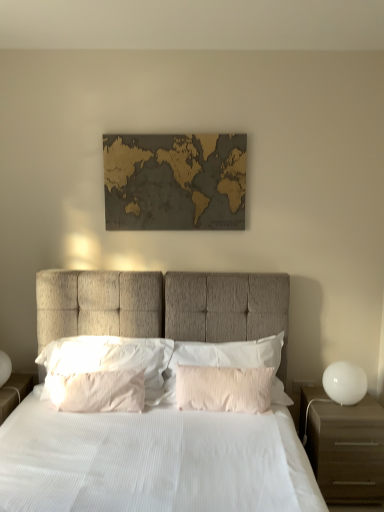
Where is `free space above wooden map at center (from a real-world perspective)`? The height and width of the screenshot is (512, 384). free space above wooden map at center (from a real-world perspective) is located at coordinates (170, 132).